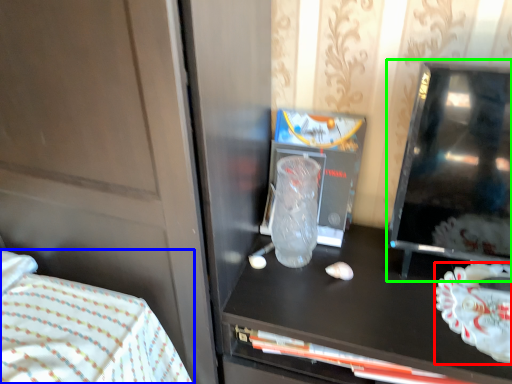
Question: Estimate the real-world distances between objects in this image. Which object is farther from food (highlighted by a red box), bed (highlighted by a blue box) or appliance (highlighted by a green box)?

Choices:
 (A) bed
 (B) appliance

Answer: (A)